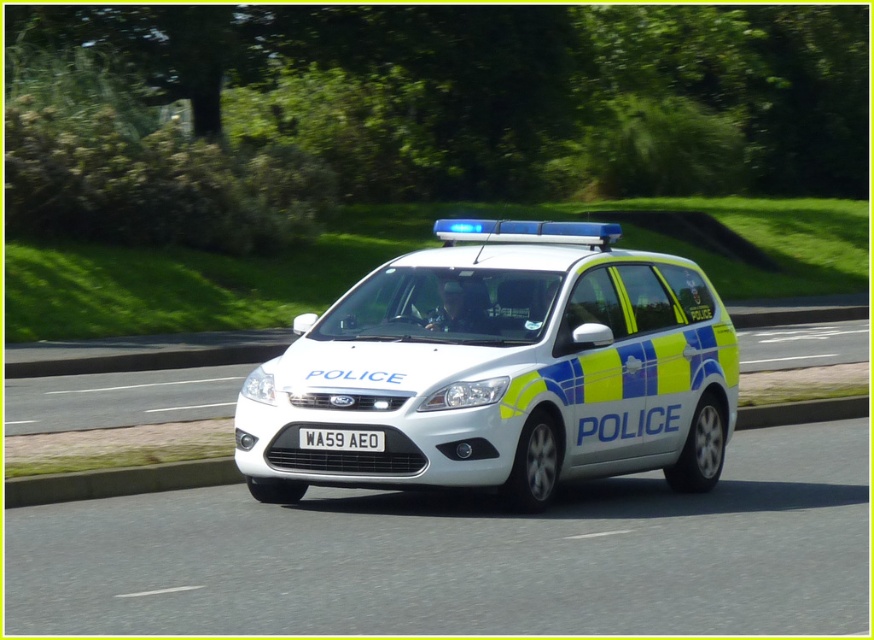
Question: In this image, where is white glossy police car at center located relative to white plastic license plate at center?

Choices:
 (A) right
 (B) left

Answer: (A)

Question: Which of the following is the closest to the observer?

Choices:
 (A) (341, 312)
 (B) (359, 435)

Answer: (B)

Question: Does white glossy police car at center have a lesser width compared to white plastic license plate at center?

Choices:
 (A) no
 (B) yes

Answer: (A)

Question: Does white glossy police car at center appear under white plastic license plate at center?

Choices:
 (A) no
 (B) yes

Answer: (A)